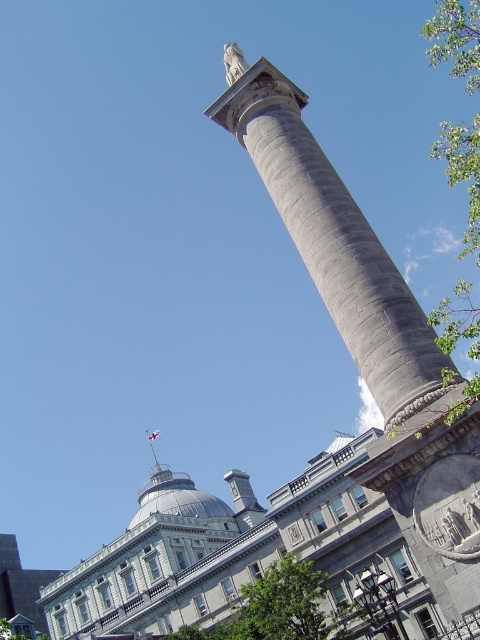
Is gray stone column at center above green leafy tree at lower center?

Indeed, gray stone column at center is positioned over green leafy tree at lower center.

Between gray stone column at center and green leafy tree at lower center, which one has less height?

green leafy tree at lower center

In order to click on gray stone column at center in this screenshot , I will do `click(336, 243)`.

Where is `gray stone column at center`? gray stone column at center is located at coordinates (336, 243).

Is green leafy tree at right thinner than green leafy tree at lower center?

In fact, green leafy tree at right might be wider than green leafy tree at lower center.

The image size is (480, 640). In order to click on green leafy tree at right in this screenshot , I will do `click(456, 38)`.

The image size is (480, 640). I want to click on green leafy tree at right, so click(456, 38).

The height and width of the screenshot is (640, 480). Identify the location of green leafy tree at right. (456, 38).

In the scene shown: Does gray stone column at center appear over green leafy tree at right?

No, gray stone column at center is not above green leafy tree at right.

Between gray stone column at center and green leafy tree at right, which one appears on the left side from the viewer's perspective?

Positioned to the left is gray stone column at center.

Does point (331, 307) come farther from viewer compared to point (468, 83)?

No, it is not.

Locate an element on the screen. The width and height of the screenshot is (480, 640). gray stone column at center is located at coordinates (336, 243).